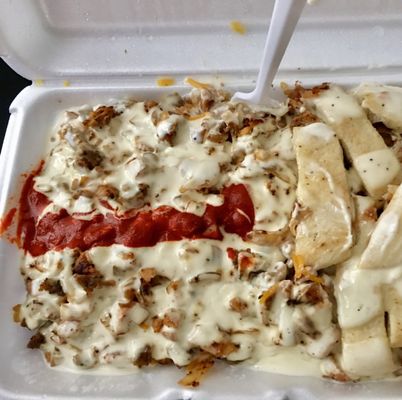
The image size is (402, 400). Identify the location of fork. coord(283,29).